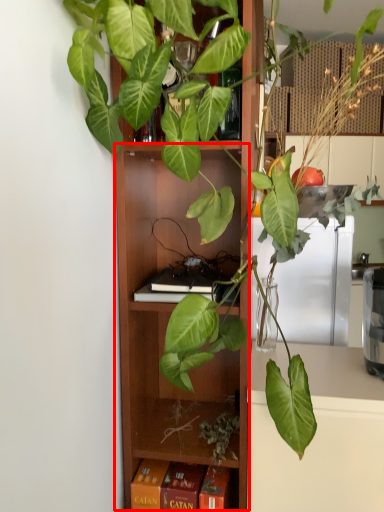
Question: From the image, what is the correct spatial relationship of cabinet (annotated by the red box) in relation to paperback book?

Choices:
 (A) right
 (B) left

Answer: (A)